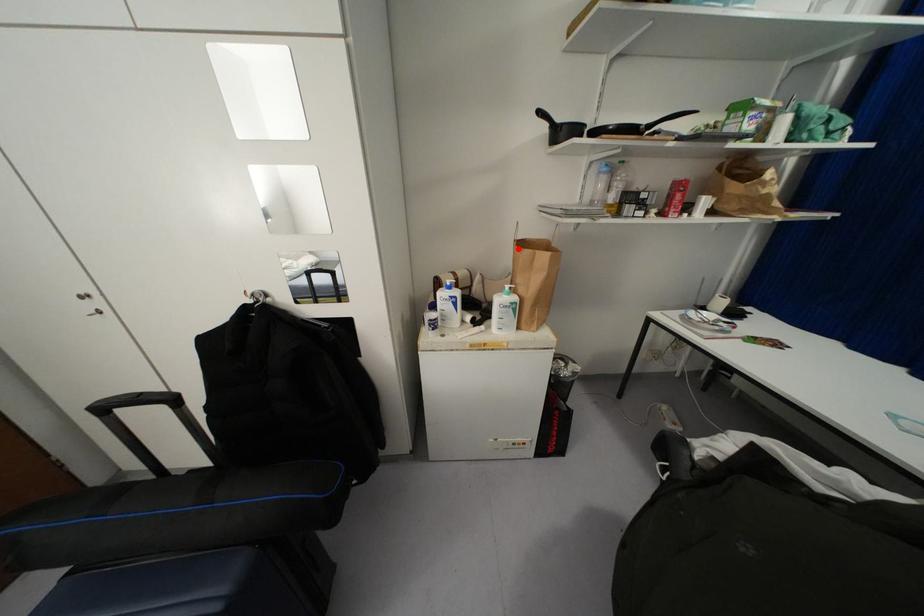
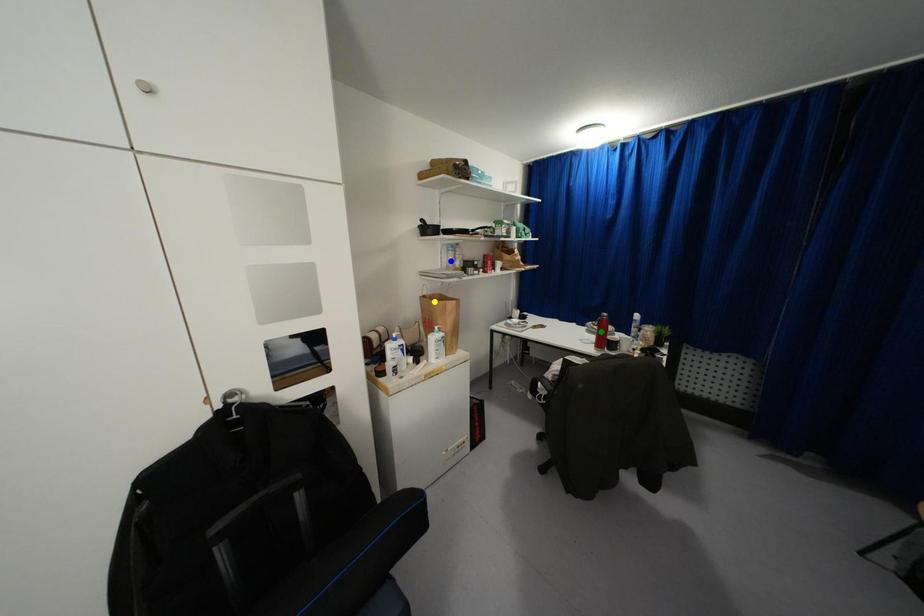
Question: I am providing you with two images of the same scene from different viewpoints. A red point is marked on the first image. You are given multiple points on the second image. Which spot in image 2 lines up with the point in image 1?

Choices:
 (A) blue point
 (B) yellow point
 (C) green point

Answer: (B)